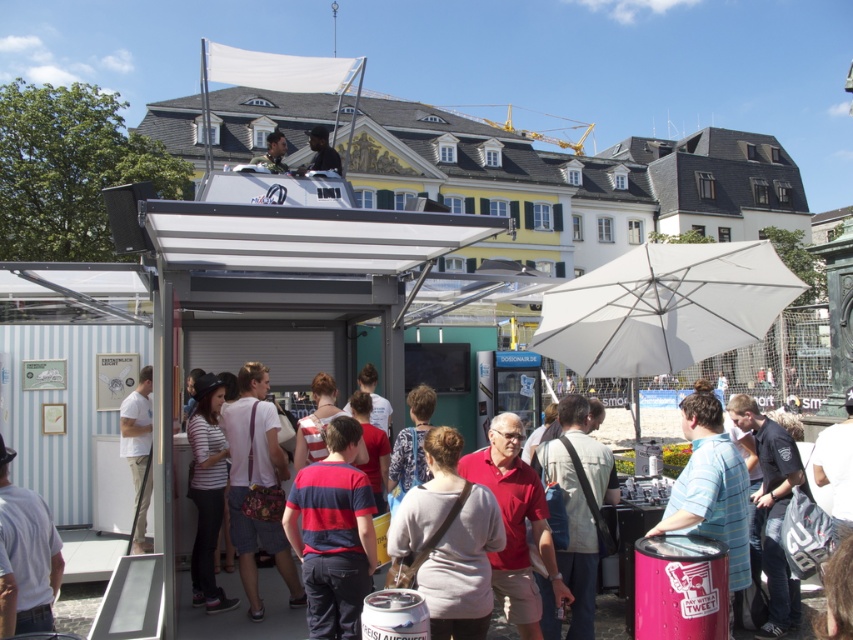
Does white cotton shirt at center appear on the right side of matte black shirt at upper center?

Yes, white cotton shirt at center is to the right of matte black shirt at upper center.

Who is more distant from viewer, (132, 484) or (312, 161)?

Positioned behind is point (312, 161).

The width and height of the screenshot is (853, 640). What do you see at coordinates (138, 451) in the screenshot?
I see `white cotton shirt at center` at bounding box center [138, 451].

Image resolution: width=853 pixels, height=640 pixels. I want to click on white cotton shirt at center, so click(x=138, y=451).

Is the position of white matte umbrella at center more distant than that of white cotton shirt at center?

No.

Between white matte umbrella at center and white cotton shirt at center, which one has less height?

Standing shorter between the two is white cotton shirt at center.

Find the location of a particular element. white matte umbrella at center is located at coordinates (664, 307).

Is white matte umbrella at center to the left of matte black shirt at upper center from the viewer's perspective?

Incorrect, white matte umbrella at center is not on the left side of matte black shirt at upper center.

Can you confirm if white matte umbrella at center is positioned below matte black shirt at upper center?

Yes.

Is point (770, 246) closer to viewer compared to point (328, 152)?

That is True.

Where is `white matte umbrella at center`? Image resolution: width=853 pixels, height=640 pixels. white matte umbrella at center is located at coordinates (664, 307).